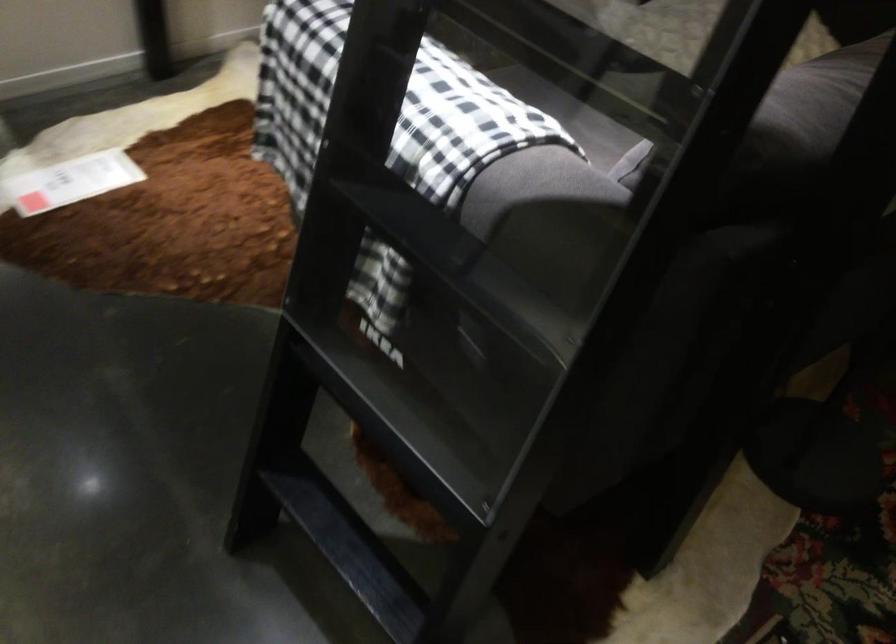
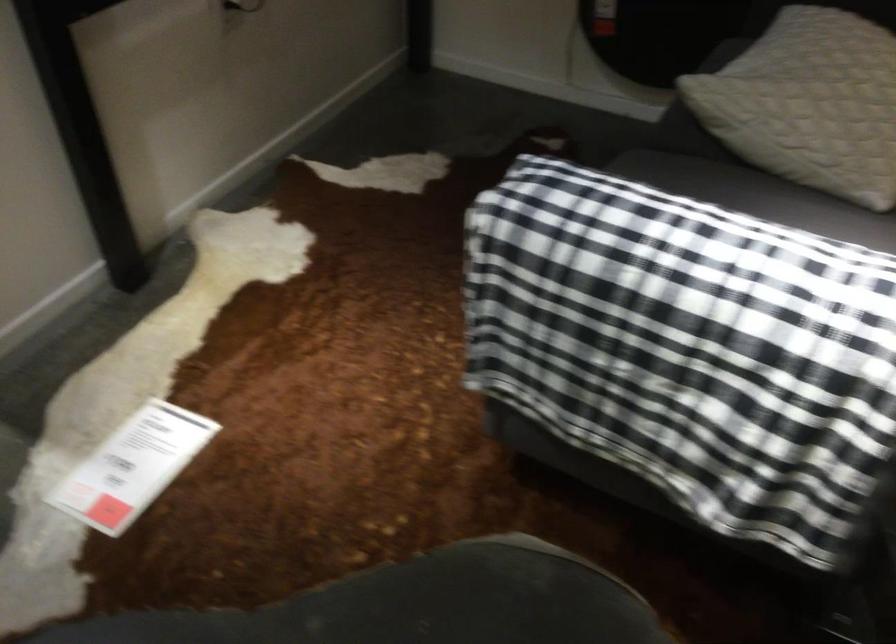
Question: Based on the continuous images, in which direction is the camera rotating? Reply with the corresponding letter.

Choices:
 (A) Left
 (B) Right
 (C) Up
 (D) Down

Answer: (B)